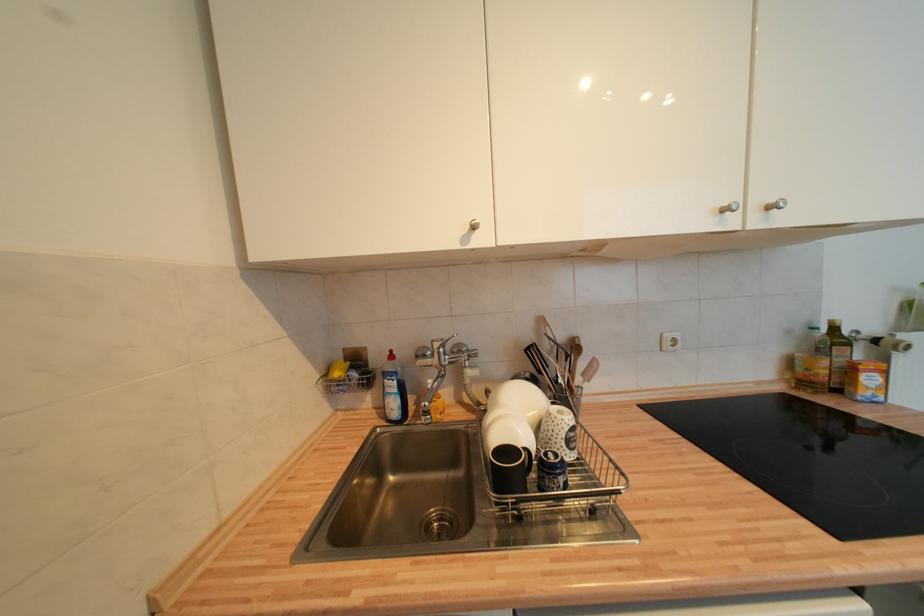
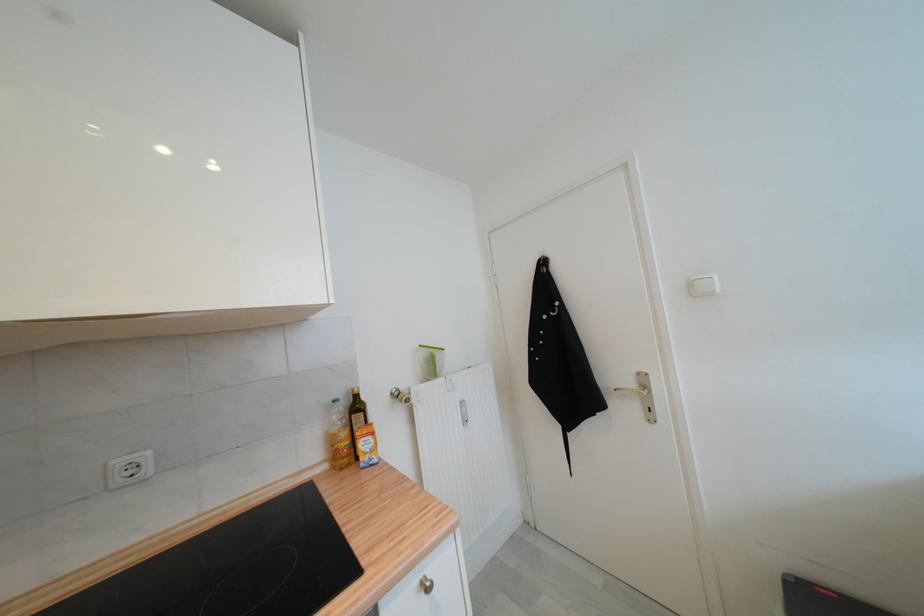
Where in the second image is the point corresponding to [819,331] from the first image?

(339, 403)